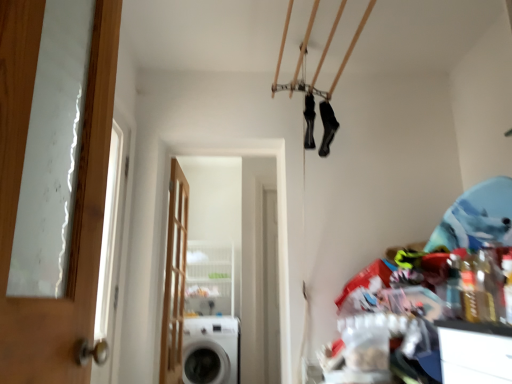
Question: Does black matte socks at upper center, the second shoe from the left, have a smaller size compared to white glossy washing machine at lower center?

Choices:
 (A) no
 (B) yes

Answer: (B)

Question: Can you confirm if black matte socks at upper center, which ranks as the 1th shoe in right-to-left order, is thinner than white glossy washing machine at lower center?

Choices:
 (A) yes
 (B) no

Answer: (A)

Question: Is black matte socks at upper center, which ranks as the 1th shoe in right-to-left order, turned away from white glossy washing machine at lower center?

Choices:
 (A) no
 (B) yes

Answer: (A)

Question: Can you confirm if black matte socks at upper center, which ranks as the 1th shoe in right-to-left order, is shorter than white glossy washing machine at lower center?

Choices:
 (A) no
 (B) yes

Answer: (B)

Question: Considering the relative sizes of black matte socks at upper center, the second shoe from the left, and white glossy washing machine at lower center in the image provided, is black matte socks at upper center, the second shoe from the left, taller than white glossy washing machine at lower center?

Choices:
 (A) yes
 (B) no

Answer: (B)

Question: Is black matte socks at upper center, the second shoe from the left, outside of white glossy washing machine at lower center?

Choices:
 (A) yes
 (B) no

Answer: (A)

Question: Considering the relative positions of white glossy screen door at center and wooden door at center, the 1th door from the back, in the image provided, is white glossy screen door at center to the left of wooden door at center, the 1th door from the back, from the viewer's perspective?

Choices:
 (A) yes
 (B) no

Answer: (B)

Question: Considering the relative sizes of white glossy screen door at center and wooden door at center, which is the second door from right to left, in the image provided, is white glossy screen door at center shorter than wooden door at center, which is the second door from right to left,?

Choices:
 (A) yes
 (B) no

Answer: (A)

Question: From the image's perspective, is white glossy screen door at center on top of wooden door at center, the second door viewed from the front?

Choices:
 (A) yes
 (B) no

Answer: (A)

Question: Considering the relative positions of white glossy screen door at center and wooden door at center, the second door viewed from the front, in the image provided, is white glossy screen door at center to the right of wooden door at center, the second door viewed from the front, from the viewer's perspective?

Choices:
 (A) yes
 (B) no

Answer: (A)

Question: From the image's perspective, would you say white glossy screen door at center is shown under wooden door at center, which is the second door from right to left?

Choices:
 (A) yes
 (B) no

Answer: (B)

Question: Is white glossy screen door at center behind wooden door at center, which is the second door from right to left?

Choices:
 (A) yes
 (B) no

Answer: (B)

Question: From a real-world perspective, is white glossy washing machine at lower center over wooden door at center, the second door viewed from the front?

Choices:
 (A) yes
 (B) no

Answer: (B)